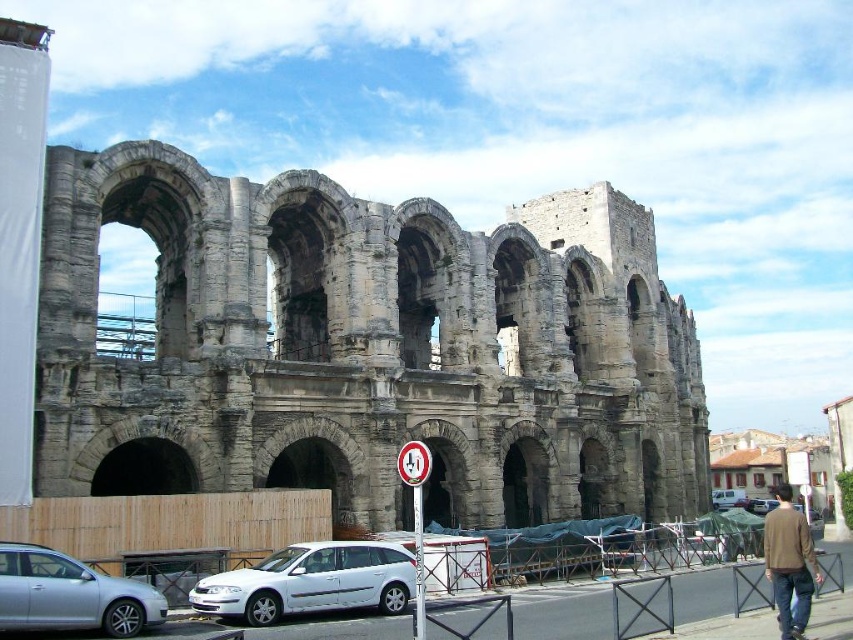
You are a tourist standing in front of the gray stone amphitheater at center and the metallic reflective sign at center. Which object is positioned to the left?

The metallic reflective sign at center is positioned to the left of the gray stone amphitheater at center.

You are a tour guide explaining the historical site to visitors. You point out the gray stone amphitheater at center and the metallic reflective sign at center. Which object is larger in size?

The gray stone amphitheater at center is bigger than the metallic reflective sign at center.

You are a delivery driver who needs to park your truck between the white plastic sign at center and the white matte van at center. Is there enough space for your truck which is 6 meters long?

The white plastic sign at center is to the left of the white matte van at center, but the distance between them isn not specified. Without knowing the exact spacing, it is impossible to determine if the 6 meter truck can fit.